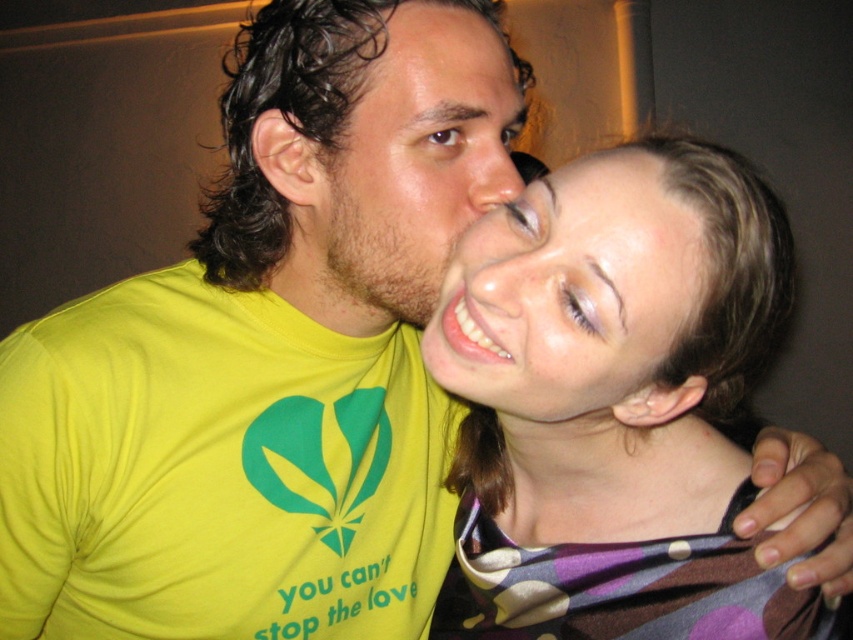
You are a photographer trying to frame a close portrait of the two people in the scene. Given that the multicolored fabric scarf at center and the smooth skin face at center are both in focus, which object would appear wider in the final photo?

The multicolored fabric scarf at center would appear wider in the final photo because its width is larger than the smooth skin face at center according to the description.

You are a photographer trying to capture a close portrait of the two people in the scene. Your camera has a focus range of 3 inches. Can you focus on both smooth skin face at center and brown matte skin at center simultaneously?

The smooth skin face at center and brown matte skin at center are 4.08 inches apart, which exceeds the camera focus range of 3 inches. Therefore, you cannot focus on both simultaneously.

You are a photographer standing 2 feet away from the scene. You want to capture a closeup of the multicolored fabric scarf at center without including the two people. Is the scarf within your camera lens range if the camera can focus as close as 18 inches?

The multicolored fabric scarf at center is 18.15 inches away from the viewer. Since the camera can focus as close as 18 inches, the scarf is just slightly out of focus range. You might need to adjust your position or use a macro lens for closer focusing.